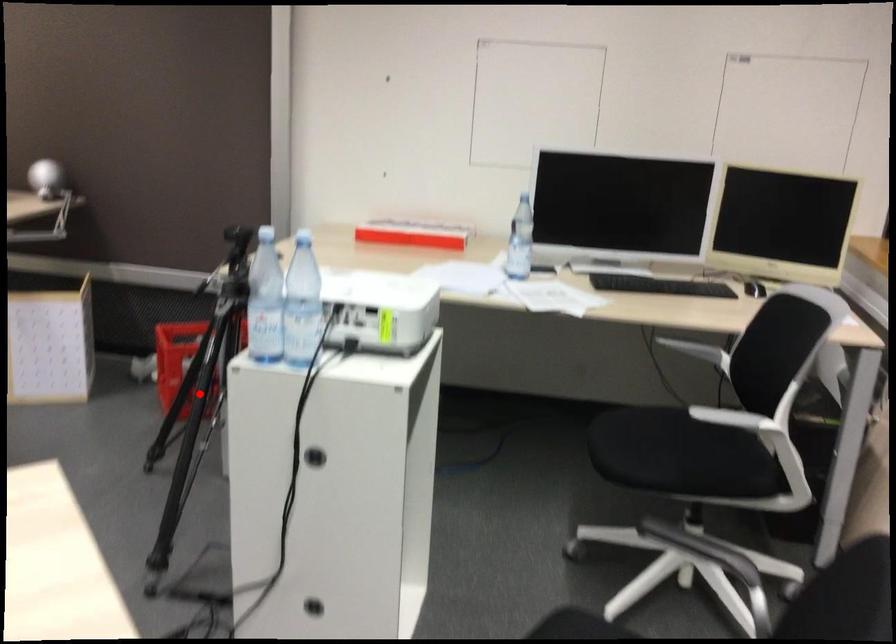
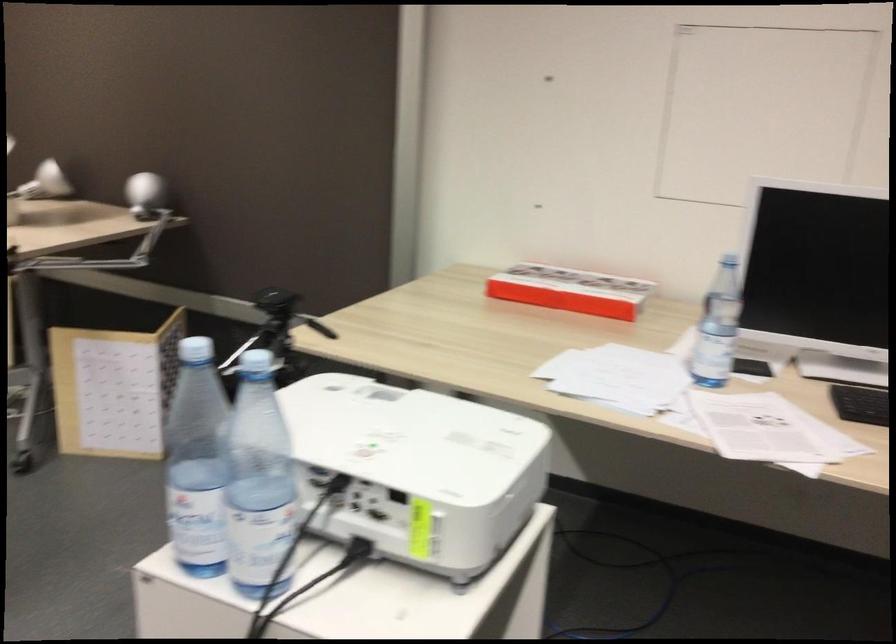
Question: I am providing you with two images of the same scene from different viewpoints. A red point is marked on the first image. Can you still see the location of the red point in image 2?

Choices:
 (A) Yes
 (B) No

Answer: (B)